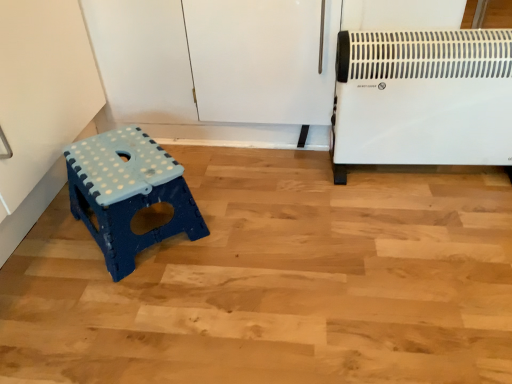
Find the location of a particular element. Image resolution: width=512 pixels, height=384 pixels. vacant area located to the right-hand side of blue plastic stool at lower left is located at coordinates (243, 228).